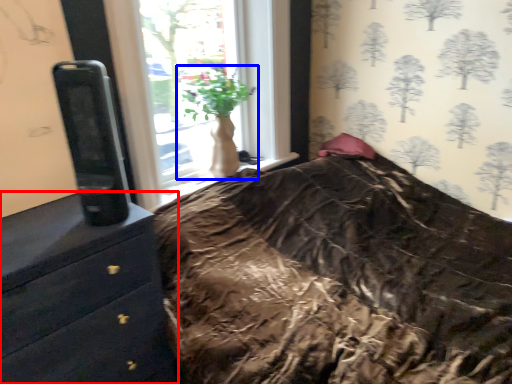
Question: Which point is further to the camera, chest of drawers (highlighted by a red box) or houseplant (highlighted by a blue box)?

Choices:
 (A) chest of drawers
 (B) houseplant

Answer: (B)